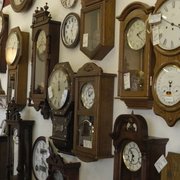
The height and width of the screenshot is (180, 180). Find the location of `dark mark on wall`. dark mark on wall is located at coordinates (7, 3).